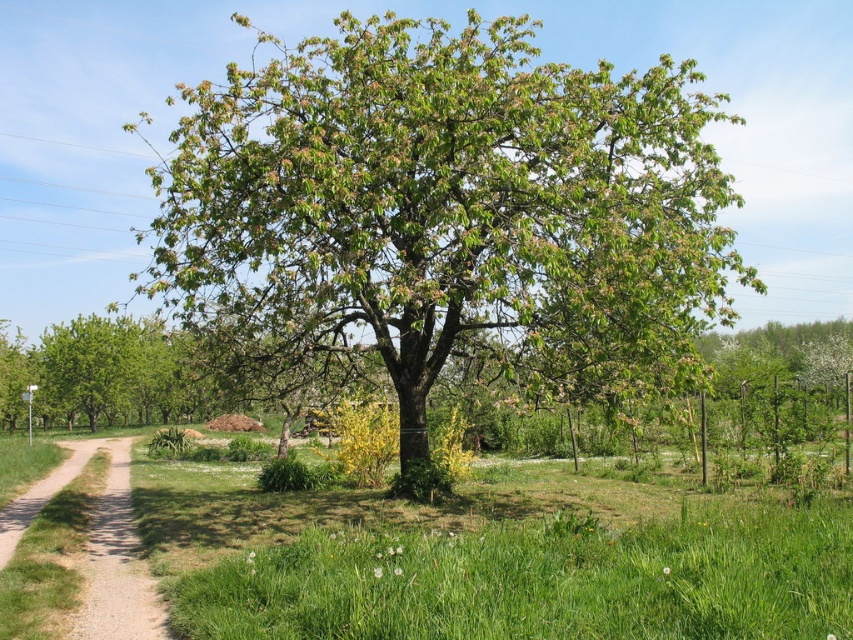
Question: Is green leafy tree at center above green leafy tree at left?

Choices:
 (A) no
 (B) yes

Answer: (B)

Question: Is green leafy tree at center below green leafy tree at left?

Choices:
 (A) no
 (B) yes

Answer: (A)

Question: Is green grass at center smaller than dirt/gravel path at left?

Choices:
 (A) yes
 (B) no

Answer: (A)

Question: Which object is the farthest from the green leafy tree at left?

Choices:
 (A) green grass at center
 (B) green leafy tree at center
 (C) dirt/gravel path at left

Answer: (A)

Question: Among these objects, which one is farthest from the camera?

Choices:
 (A) dirt/gravel path at left
 (B) green leafy tree at left
 (C) green grass at center
 (D) green leafy tree at center

Answer: (B)

Question: Estimate the real-world distances between objects in this image. Which object is farther from the green grass at center?

Choices:
 (A) green leafy tree at left
 (B) green leafy tree at center

Answer: (A)